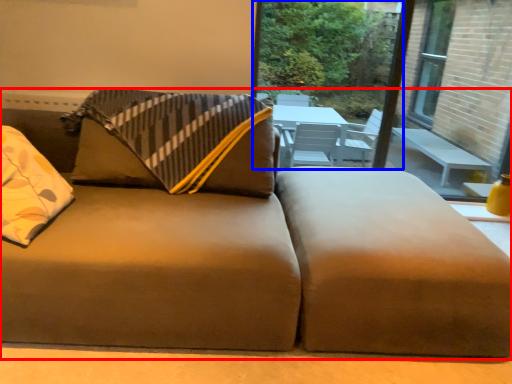
Question: Which object is further to the camera taking this photo, studio couch (highlighted by a red box) or window screen (highlighted by a blue box)?

Choices:
 (A) studio couch
 (B) window screen

Answer: (B)